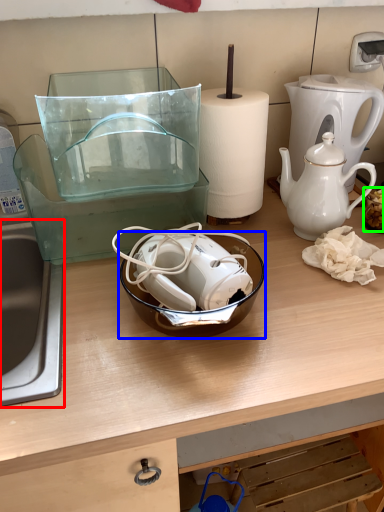
Question: Considering the real-world distances, which object is farthest from sink (highlighted by a red box)? bowl (highlighted by a blue box) or food (highlighted by a green box)?

Choices:
 (A) bowl
 (B) food

Answer: (B)